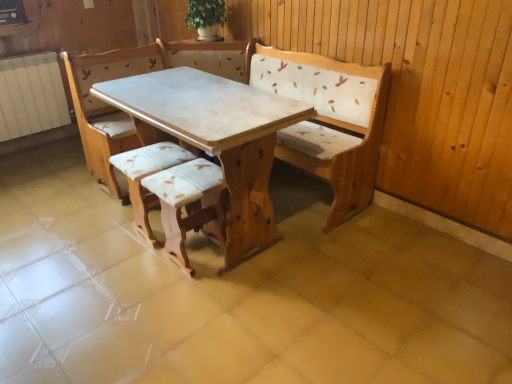
Question: From the image's perspective, is white marble table at center under matte white cushioned stool at center, which is the second armchair in right-to-left order?

Choices:
 (A) no
 (B) yes

Answer: (A)

Question: Considering the relative sizes of white marble table at center and matte white cushioned stool at center, which is the first armchair in left-to-right order, in the image provided, is white marble table at center wider than matte white cushioned stool at center, which is the first armchair in left-to-right order,?

Choices:
 (A) no
 (B) yes

Answer: (B)

Question: Is white marble table at center at the left side of matte white cushioned stool at center, which is the first armchair in left-to-right order?

Choices:
 (A) no
 (B) yes

Answer: (A)

Question: Considering the relative sizes of white marble table at center and matte white cushioned stool at center, which is the first armchair in left-to-right order, in the image provided, is white marble table at center smaller than matte white cushioned stool at center, which is the first armchair in left-to-right order,?

Choices:
 (A) no
 (B) yes

Answer: (A)

Question: Is white marble table at center oriented away from matte white cushioned stool at center, which is the first armchair in left-to-right order?

Choices:
 (A) yes
 (B) no

Answer: (B)

Question: Considering the relative sizes of white marble table at center and matte white cushioned stool at center, which is the second armchair in right-to-left order, in the image provided, is white marble table at center thinner than matte white cushioned stool at center, which is the second armchair in right-to-left order,?

Choices:
 (A) no
 (B) yes

Answer: (A)

Question: Can you confirm if matte white cushioned stool at center, which is the first armchair in left-to-right order, is bigger than wooden armchair at center, which is the 2th armchair in left-to-right order?

Choices:
 (A) yes
 (B) no

Answer: (B)

Question: Is matte white cushioned stool at center, which is the second armchair in right-to-left order, turned away from wooden armchair at center, which is the 2th armchair in left-to-right order?

Choices:
 (A) no
 (B) yes

Answer: (A)

Question: Are matte white cushioned stool at center, which is the first armchair in left-to-right order, and wooden armchair at center, the 1th armchair viewed from the right, making contact?

Choices:
 (A) no
 (B) yes

Answer: (A)

Question: Does matte white cushioned stool at center, which is the second armchair in right-to-left order, have a lesser height compared to wooden armchair at center, which is the 2th armchair in left-to-right order?

Choices:
 (A) no
 (B) yes

Answer: (B)

Question: Is the position of matte white cushioned stool at center, which is the second armchair in right-to-left order, more distant than that of wooden armchair at center, the 1th armchair viewed from the right?

Choices:
 (A) yes
 (B) no

Answer: (A)

Question: Is matte white cushioned stool at center, which is the first armchair in left-to-right order, taller than wooden armchair at center, which is the 2th armchair in left-to-right order?

Choices:
 (A) no
 (B) yes

Answer: (A)

Question: Is white marble table at center bigger than wooden armchair at center, which is the 2th armchair in left-to-right order?

Choices:
 (A) no
 (B) yes

Answer: (B)